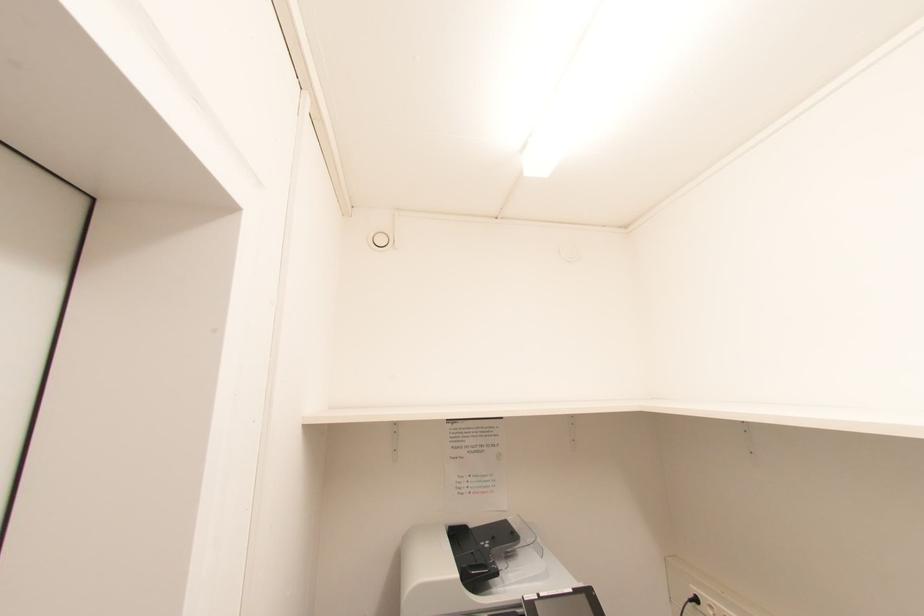
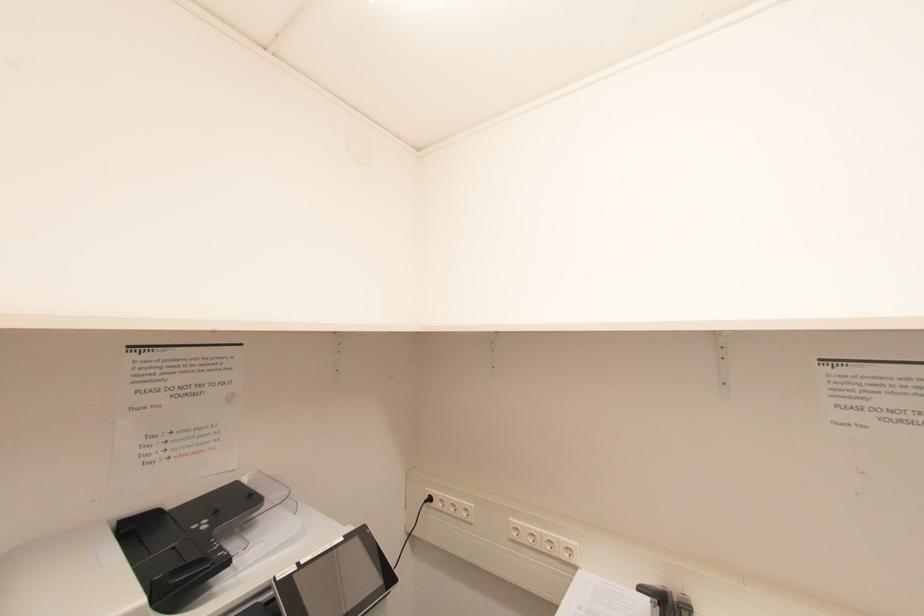
Question: The camera is either moving clockwise (left) or counter-clockwise (right) around the object. The first image is from the beginning of the video and the second image is from the end. Is the camera moving left or right when shooting the video?

Choices:
 (A) Left
 (B) Right

Answer: (A)